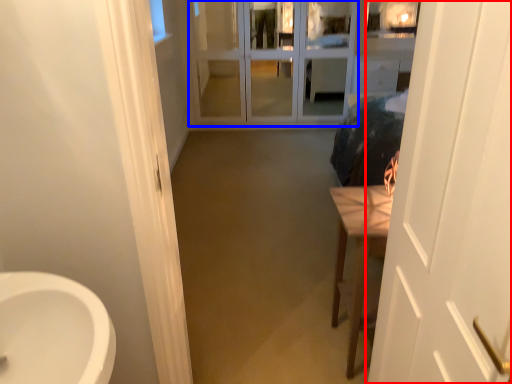
Question: Among these objects, which one is farthest to the camera, door (highlighted by a red box) or screen door (highlighted by a blue box)?

Choices:
 (A) door
 (B) screen door

Answer: (B)